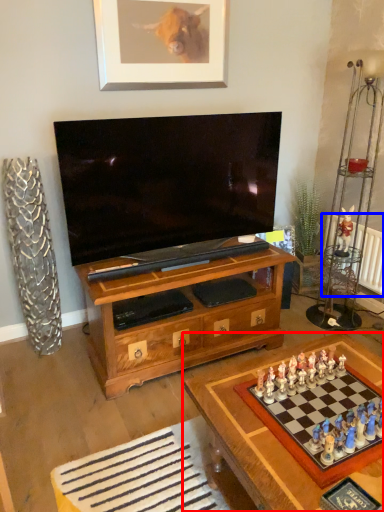
Question: Which point is further to the camera, table (highlighted by a red box) or radiator (highlighted by a blue box)?

Choices:
 (A) table
 (B) radiator

Answer: (B)